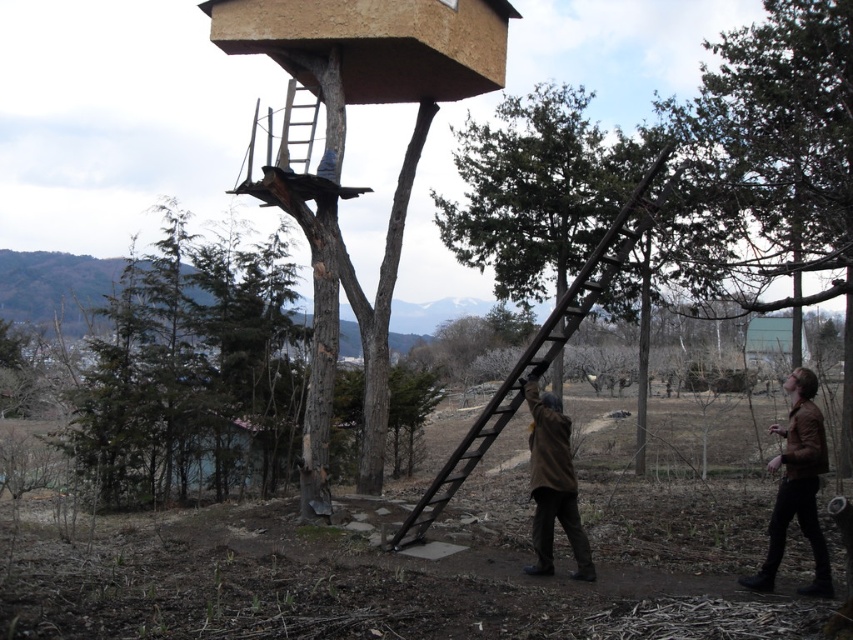
Question: Is rusty metal ladder at center below wooden at center?

Choices:
 (A) no
 (B) yes

Answer: (B)

Question: Among these points, which one is farthest from the camera?

Choices:
 (A) (305, 161)
 (B) (540, 525)

Answer: (A)

Question: Which point is closer to the camera?

Choices:
 (A) brown woolen coat at lower center
 (B) wooden at center

Answer: (A)

Question: Which of the following is the farthest from the observer?

Choices:
 (A) brown leather jacket at lower right
 (B) brown woolen coat at lower center
 (C) rusty metal ladder at center
 (D) wooden at center

Answer: (D)

Question: Is brown woolen coat at lower center bigger than wooden at center?

Choices:
 (A) no
 (B) yes

Answer: (A)

Question: Where is brown leather jacket at lower right located in relation to wooden at center in the image?

Choices:
 (A) left
 (B) right

Answer: (B)